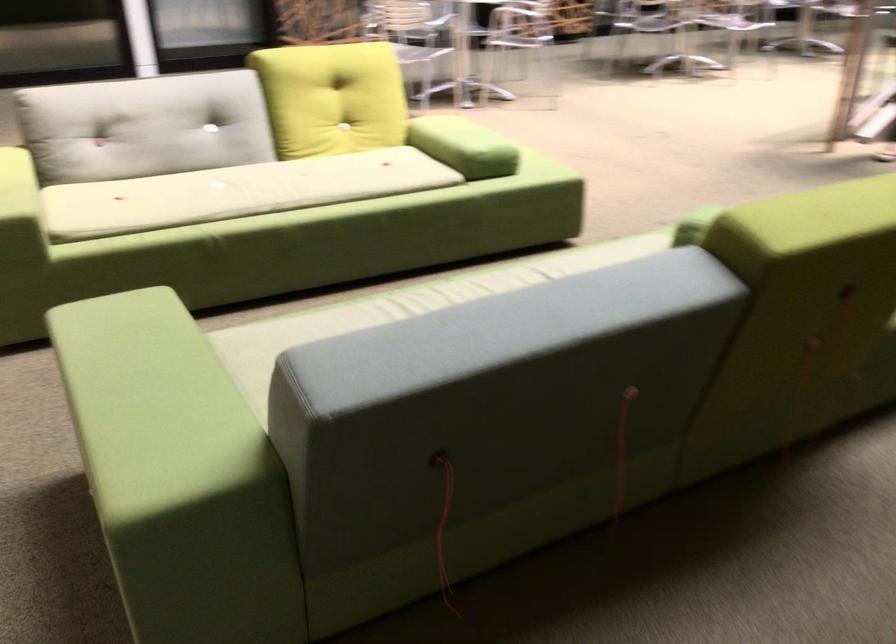
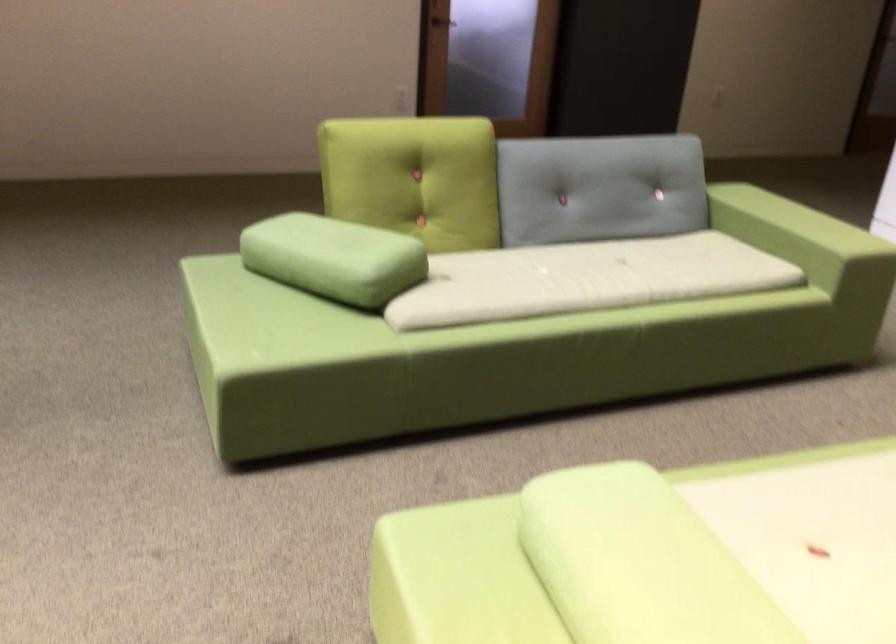
Find the pixel in the second image that matches point (193, 326) in the first image.

(794, 241)